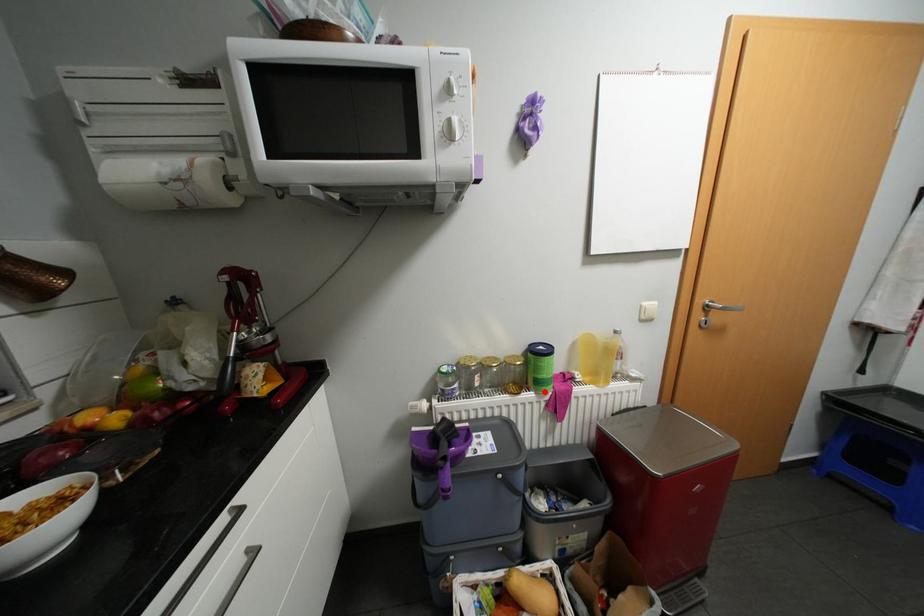
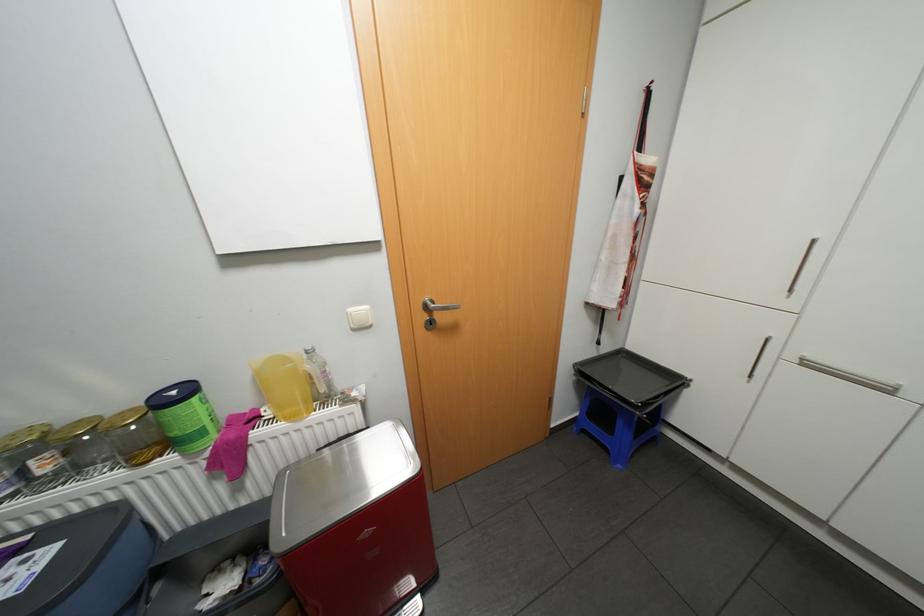
In the second image, find the point that corresponds to the highlighted location in the first image.

(190, 453)